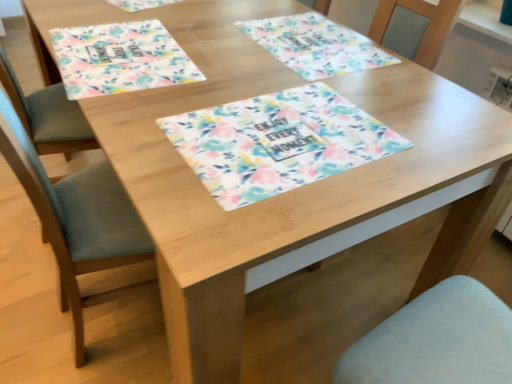
Locate an element on the screen. spots to the right of floral fabric placemat at center is located at coordinates tap(429, 127).